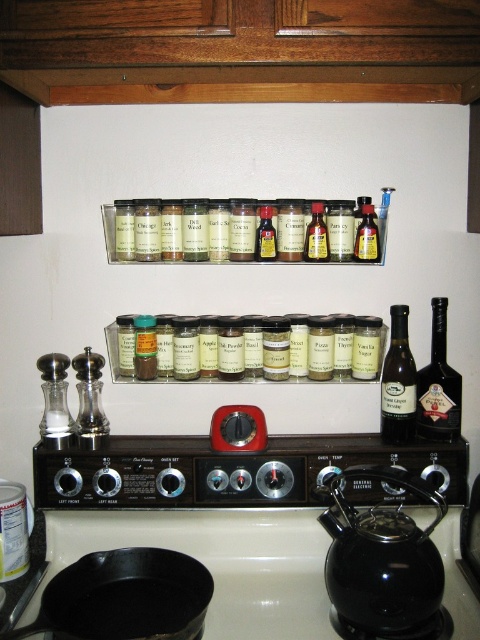
Question: Does black cast iron frying pan at lower left appear on the right side of clear glass jars at center?

Choices:
 (A) no
 (B) yes

Answer: (A)

Question: Which point is farther from the camera taking this photo?

Choices:
 (A) (290, 260)
 (B) (264, 381)

Answer: (B)

Question: Is black ceramic teapot at lower right closer to the viewer compared to clear glass jars at center?

Choices:
 (A) no
 (B) yes

Answer: (B)

Question: Estimate the real-world distances between objects in this image. Which object is closer to the translucent glass bottle at center?

Choices:
 (A) dark glass bottle at right
 (B) clear glass jars at center
 (C) black ceramic teapot at lower right

Answer: (B)

Question: Among these objects, which one is nearest to the camera?

Choices:
 (A) black cast iron frying pan at lower left
 (B) dark brown glass bottle at center-right
 (C) translucent glass spice jars at center

Answer: (A)

Question: Can you confirm if yellow glass bottle at center is positioned above translucent amber bottle at center?

Choices:
 (A) yes
 (B) no

Answer: (A)